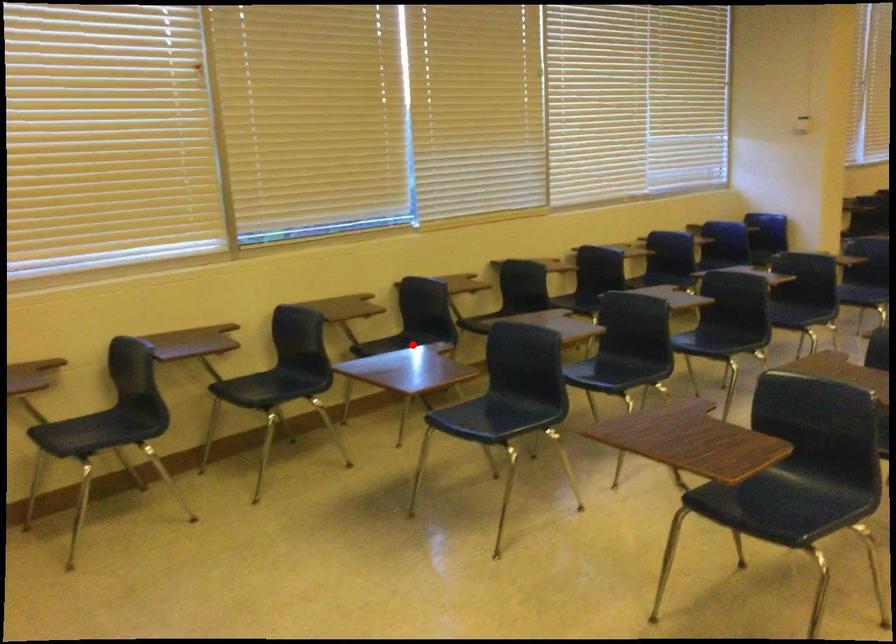
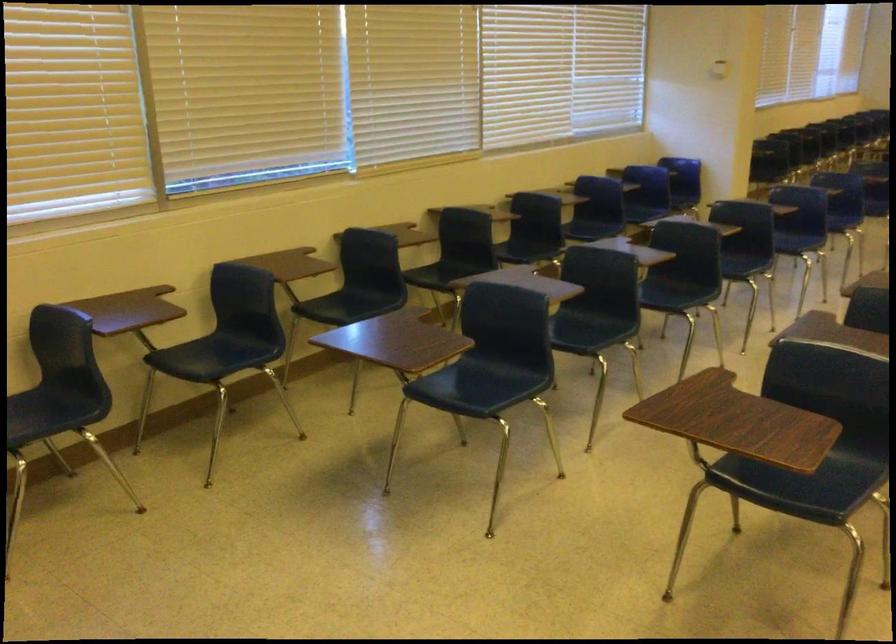
Find the pixel in the second image that matches the highlighted location in the first image.

(359, 303)